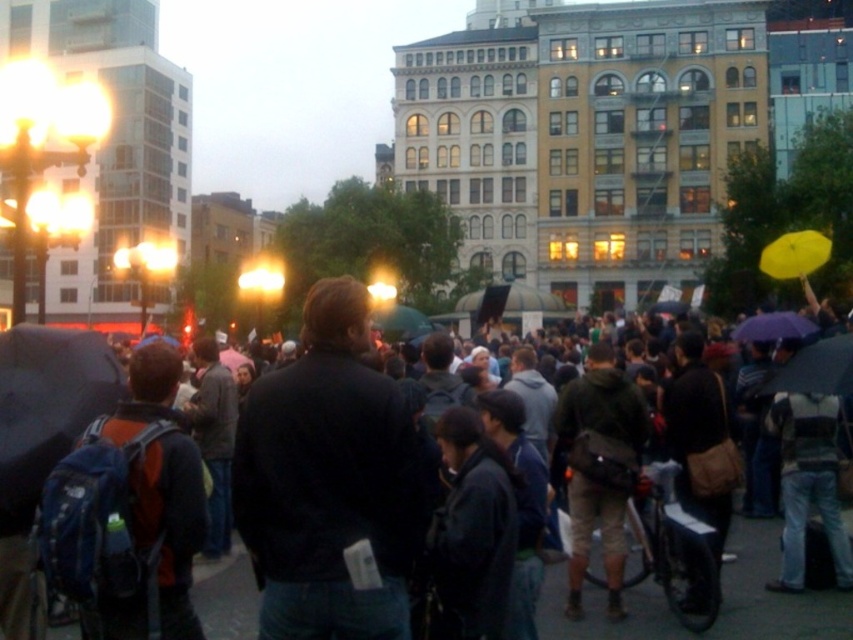
Question: Which of these objects is positioned farthest from the yellow matte umbrella at upper right?

Choices:
 (A) matte purple umbrella at center
 (B) matte black umbrella at left

Answer: (B)

Question: Based on their relative distances, which object is farther from the dark blue backpack at center?

Choices:
 (A) black leather jacket at center
 (B) matte purple umbrella at center

Answer: (A)

Question: Which point is farther from the camera taking this photo?

Choices:
 (A) (337, 472)
 (B) (822, 369)

Answer: (B)

Question: Is matte purple umbrella at center bigger than yellow matte umbrella at upper right?

Choices:
 (A) no
 (B) yes

Answer: (B)

Question: Where is dark blue backpack at center located in relation to yellow matte umbrella at upper right in the image?

Choices:
 (A) below
 (B) above

Answer: (A)

Question: In this image, where is dark blue backpack at center located relative to matte black umbrella at left?

Choices:
 (A) right
 (B) left

Answer: (A)